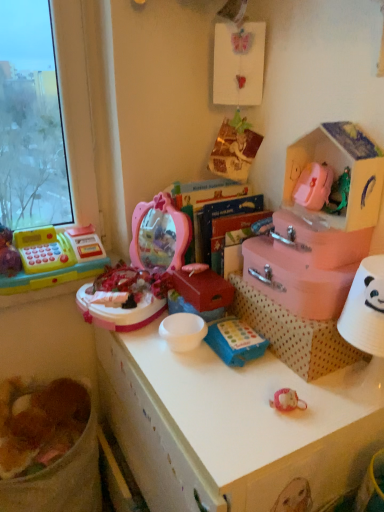
What is the approximate width of pink plastic toy at center-right, positioned as the 1th box in right-to-left order?

6.86 inches.

Identify the location of white plastic desk at center. This screenshot has height=512, width=384. (235, 426).

Locate an element on the screen. brown crumbly food at lower left is located at coordinates (39, 423).

Identify the location of pink plastic toy at center-right, positioned as the 1th box in right-to-left order. This screenshot has width=384, height=512. (318, 240).

I want to click on box behind the blue fabric toy at center, the first toy in the right-to-left sequence, so click(203, 289).

From a real-world perspective, between blue fabric toy at center, which appears as the first toy when ordered from the bottom, and matte pink box at center, marked as the 1th box in a left-to-right arrangement, who is vertically lower?

In real-world perspective, blue fabric toy at center, which appears as the first toy when ordered from the bottom, is lower.

Is blue fabric toy at center, the first toy in the right-to-left sequence, situated inside matte pink box at center, marked as the 1th box in a left-to-right arrangement, or outside?

blue fabric toy at center, the first toy in the right-to-left sequence, cannot be found inside matte pink box at center, marked as the 1th box in a left-to-right arrangement.

From the image's perspective, is blue fabric toy at center, the 2th toy when ordered from left to right, located above matte pink box at center, placed as the third box when sorted from right to left?

No, from the image's perspective, blue fabric toy at center, the 2th toy when ordered from left to right, is not above matte pink box at center, placed as the third box when sorted from right to left.

Based on the photo, visually, is matte pink box at center, placed as the third box when sorted from right to left, positioned to the left or to the right of white plastic desk at center?

From the image, it's evident that matte pink box at center, placed as the third box when sorted from right to left, is to the left of white plastic desk at center.

Is matte pink box at center, placed as the third box when sorted from right to left, wider or thinner than white plastic desk at center?

matte pink box at center, placed as the third box when sorted from right to left, is thinner than white plastic desk at center.

Which object is further away from the camera taking this photo, matte pink box at center, placed as the third box when sorted from right to left, or white plastic desk at center?

Positioned behind is matte pink box at center, placed as the third box when sorted from right to left.

In the scene shown: Could matte plastic cash register at left, the second toy from the bottom, be considered to be inside brown crumbly food at lower left?

No, brown crumbly food at lower left does not contain matte plastic cash register at left, the second toy from the bottom.

Who is shorter, brown crumbly food at lower left or matte plastic cash register at left, which is the second toy in front-to-back order?

brown crumbly food at lower left.

Based on the photo, could you measure the distance between brown crumbly food at lower left and matte plastic cash register at left, marked as the 1th toy in a back-to-front arrangement?

A distance of 15.19 inches exists between brown crumbly food at lower left and matte plastic cash register at left, marked as the 1th toy in a back-to-front arrangement.

From the image's perspective, starting from the brown crumbly food at lower left, which toy is the 2nd one above? Please provide its 2D coordinates.

[(54, 258)]

Is the depth of pink cardboard storage box at upper right less than that of pink plastic toy at center-right, the third box from the left?

Yes, pink cardboard storage box at upper right is closer to the viewer.

Considering the relative sizes of pink cardboard storage box at upper right and pink plastic toy at center-right, positioned as the 1th box in right-to-left order, in the image provided, is pink cardboard storage box at upper right shorter than pink plastic toy at center-right, positioned as the 1th box in right-to-left order,?

No, pink cardboard storage box at upper right is not shorter than pink plastic toy at center-right, positioned as the 1th box in right-to-left order.

Can we say pink cardboard storage box at upper right lies outside pink plastic toy at center-right, the third box from the left?

Yes.

Is pink cardboard storage box at upper right in contact with pink plastic toy at center-right, positioned as the 1th box in right-to-left order?

No, pink cardboard storage box at upper right is not touching pink plastic toy at center-right, positioned as the 1th box in right-to-left order.

I want to click on box located underneath the matte plastic cash register at left, arranged as the 2th toy when viewed from the right (from a real-world perspective), so click(203, 289).

Does matte plastic cash register at left, arranged as the 2th toy when viewed from the right, have a lesser width compared to matte pink box at center, placed as the third box when sorted from right to left?

No, matte plastic cash register at left, arranged as the 2th toy when viewed from the right, is not thinner than matte pink box at center, placed as the third box when sorted from right to left.

Looking at their sizes, would you say pink matte box at center-right, which appears as the second box when viewed from the right, is wider or thinner than polka dot cardboard box at center?

In the image, pink matte box at center-right, which appears as the second box when viewed from the right, appears to be more narrow than polka dot cardboard box at center.

Do you think pink matte box at center-right, which appears as the second box when viewed from the right, is within polka dot cardboard box at center, or outside of it?

pink matte box at center-right, which appears as the second box when viewed from the right, cannot be found inside polka dot cardboard box at center.

I want to click on cardboard box located on the left of pink matte box at center-right, which appears as the second box when viewed from the left, so click(293, 334).

From the picture: Is pink cardboard storage box at upper right located within white plastic desk at center?

No, pink cardboard storage box at upper right is not inside white plastic desk at center.

Considering the positions of objects white plastic desk at center and pink cardboard storage box at upper right in the image provided, who is more to the left, white plastic desk at center or pink cardboard storage box at upper right?

white plastic desk at center.

In the scene shown: Which of these two, white plastic desk at center or pink cardboard storage box at upper right, is bigger?

Bigger between the two is white plastic desk at center.

Considering the relative positions of white plastic desk at center and pink cardboard storage box at upper right in the image provided, is white plastic desk at center in front of pink cardboard storage box at upper right?

Yes, it is in front of pink cardboard storage box at upper right.

The height and width of the screenshot is (512, 384). Identify the location of toy on the right side of matte pink box at center, marked as the 1th box in a left-to-right arrangement. (235, 341).

What are the coordinates of `box on the left of the white plastic desk at center` in the screenshot? It's located at (203, 289).

When comparing their distances from white plastic desk at center, does pink cardboard storage box at upper right or matte plastic cash register at left, marked as the 1th toy in a back-to-front arrangement, seem further?

Among the two, matte plastic cash register at left, marked as the 1th toy in a back-to-front arrangement, is located further to white plastic desk at center.

Estimate the real-world distances between objects in this image. Which object is further from pink plastic toy at center-right, the third box from the left, brown crumbly food at lower left or pink cardboard storage box at upper right?

brown crumbly food at lower left.

Which object lies further to the anchor point pink cardboard storage box at upper right, matte plastic cash register at left, which is the first toy from left to right, or blue fabric toy at center, the first toy in the right-to-left sequence?

matte plastic cash register at left, which is the first toy from left to right.

Looking at the image, which one is located closer to matte pink box at center, placed as the third box when sorted from right to left, pink cardboard storage box at upper right or blue fabric toy at center, which ranks as the second toy in top-to-bottom order?

Among the two, blue fabric toy at center, which ranks as the second toy in top-to-bottom order, is located nearer to matte pink box at center, placed as the third box when sorted from right to left.

Considering their positions, is pink cardboard storage box at upper right positioned further to matte pink box at center, placed as the third box when sorted from right to left, than polka dot cardboard box at center?

Based on the image, pink cardboard storage box at upper right appears to be further to matte pink box at center, placed as the third box when sorted from right to left.

Estimate the real-world distances between objects in this image. Which object is closer to matte pink box at center, marked as the 1th box in a left-to-right arrangement, pink plastic toy at center-right, the third box from the left, or matte plastic cash register at left, the second toy from the bottom?

pink plastic toy at center-right, the third box from the left, is positioned closer to the anchor matte pink box at center, marked as the 1th box in a left-to-right arrangement.

When comparing their distances from pink plastic toy at center-right, positioned as the 1th box in right-to-left order, does brown crumbly food at lower left or blue fabric toy at center, the second toy from the back, seem closer?

blue fabric toy at center, the second toy from the back, lies closer to pink plastic toy at center-right, positioned as the 1th box in right-to-left order, than the other object.

When comparing their distances from white plastic desk at center, does matte pink box at center, marked as the 1th box in a left-to-right arrangement, or pink plastic toy at center-right, the third box from the left, seem closer?

matte pink box at center, marked as the 1th box in a left-to-right arrangement.

The image size is (384, 512). Find the location of `box between matte plastic cash register at left, acting as the 1th toy starting from the top, and pink matte box at center-right, which appears as the second box when viewed from the right`. box between matte plastic cash register at left, acting as the 1th toy starting from the top, and pink matte box at center-right, which appears as the second box when viewed from the right is located at coordinates (203, 289).

Where is `cardboard box that lies between pink plastic toy at center-right, positioned as the 1th box in right-to-left order, and blue fabric toy at center, the second toy from the back, from top to bottom`? Image resolution: width=384 pixels, height=512 pixels. cardboard box that lies between pink plastic toy at center-right, positioned as the 1th box in right-to-left order, and blue fabric toy at center, the second toy from the back, from top to bottom is located at coordinates (293, 334).

Locate an element on the screen. toy between matte pink box at center, marked as the 1th box in a left-to-right arrangement, and white plastic desk at center vertically is located at coordinates (235, 341).

Where is `desk located between brown crumbly food at lower left and blue fabric toy at center, the second toy from the back, in the left-right direction`? The height and width of the screenshot is (512, 384). desk located between brown crumbly food at lower left and blue fabric toy at center, the second toy from the back, in the left-right direction is located at coordinates (235, 426).